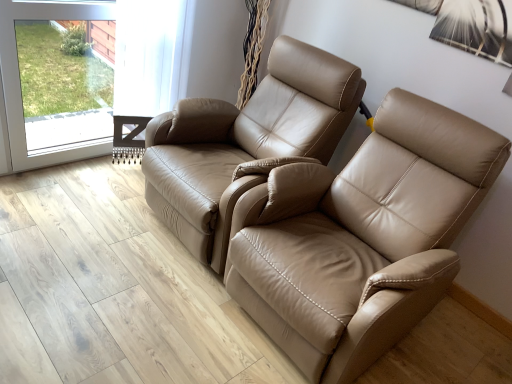
You are a GUI agent. You are given a task and a screenshot of the screen. Output one action in this format:
    pyautogui.click(x=<x>, y=<y>)
    Task: Click on the free location to the left of tan leather chair at center, arranged as the second chair when viewed from the right
    The height and width of the screenshot is (384, 512).
    Given the screenshot: What is the action you would take?
    (x=73, y=220)